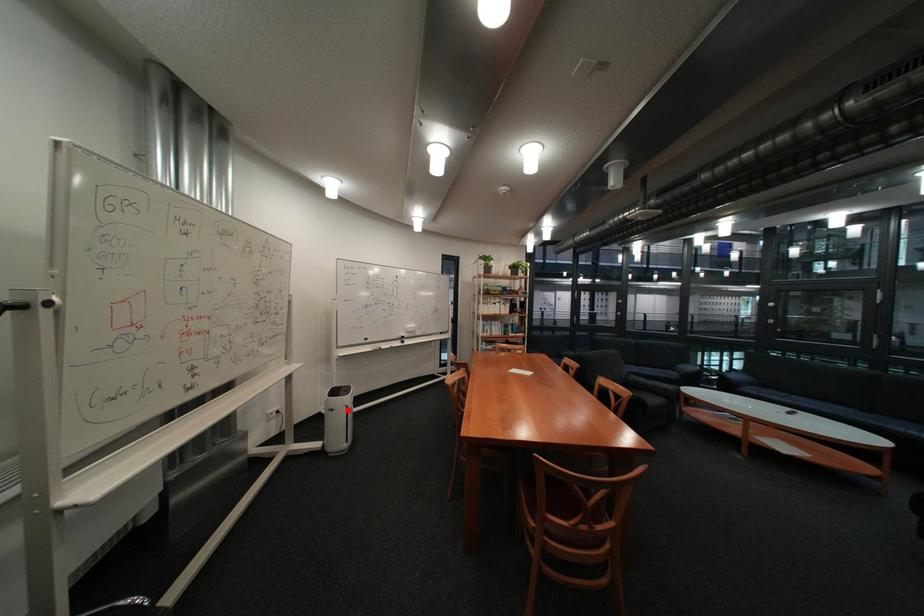
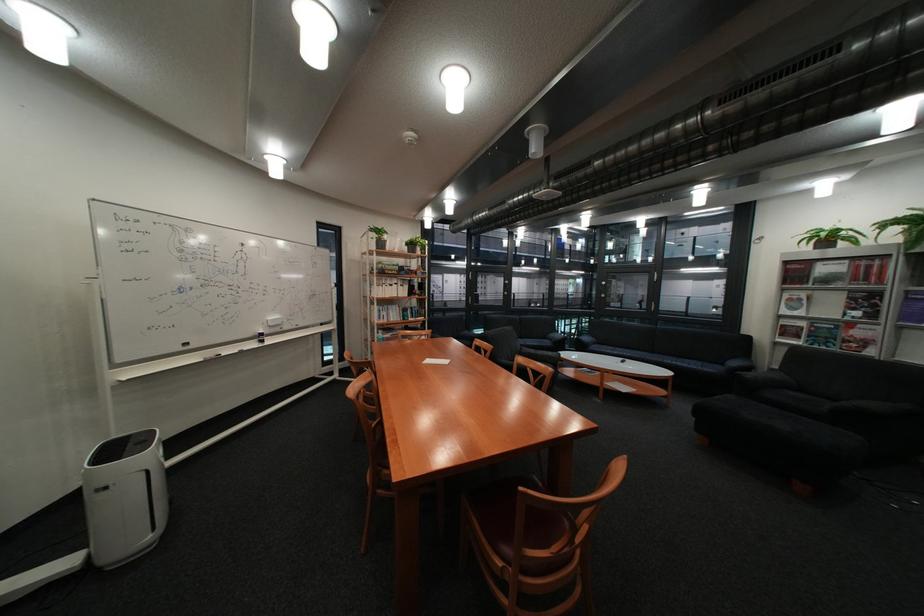
Find the pixel in the second image that matches the highlighted location in the first image.

(120, 488)